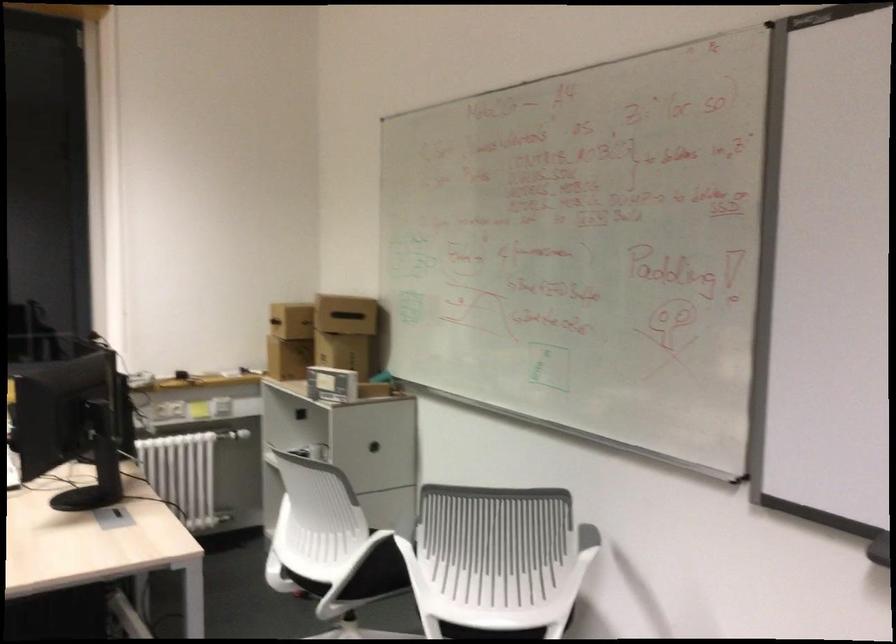
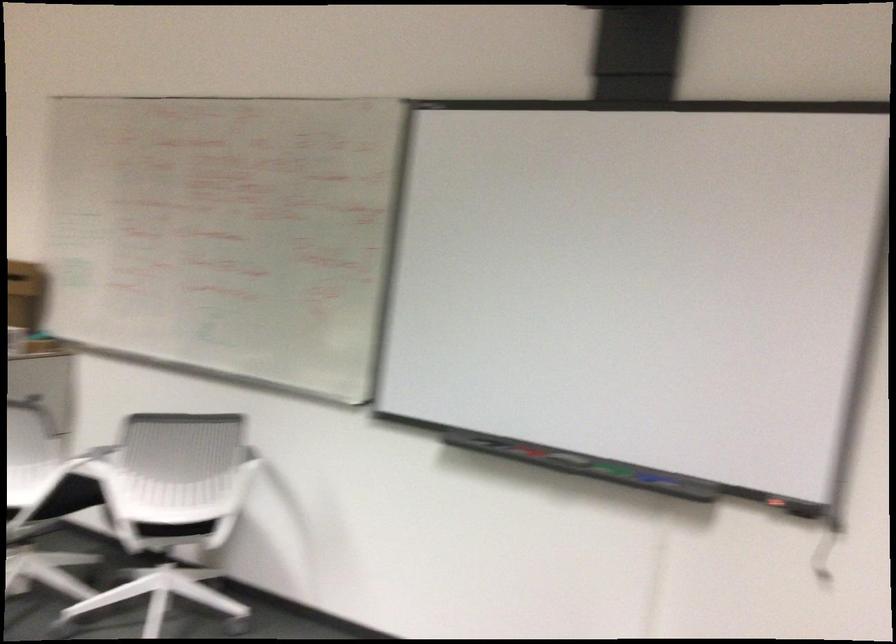
The point at (408, 527) is marked in the first image. Where is the corresponding point in the second image?

(95, 460)